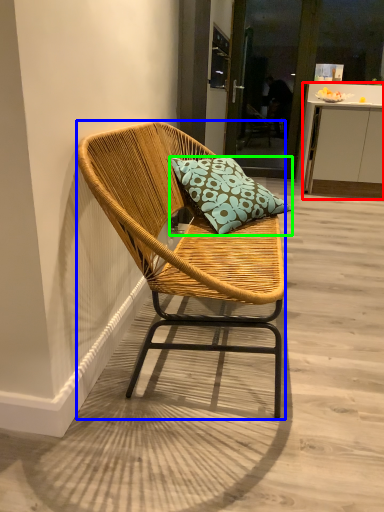
Question: Based on their relative distances, which object is nearer to cabinetry (highlighted by a red box)? Choose from chair (highlighted by a blue box) and pillow (highlighted by a green box).

Choices:
 (A) chair
 (B) pillow

Answer: (B)